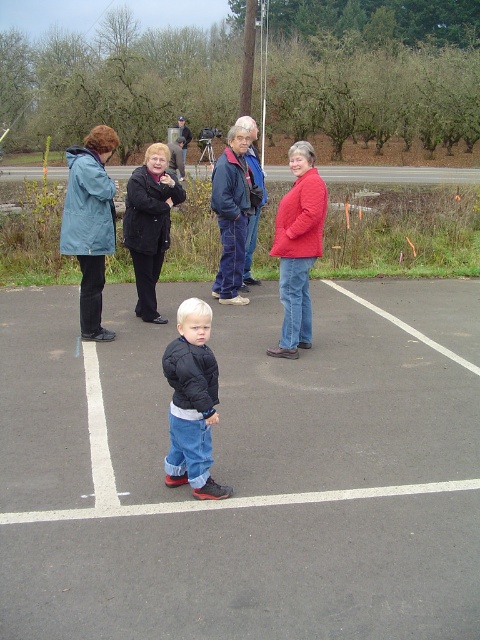
You are a photographer setting up your equipment in the parking lot. You have a blue waterproof jacket at left and a black plastic tripod at center. Which item is closer to the tripod when viewed from the photographer position?

The blue waterproof jacket at left is positioned on the right side of the black plastic tripod at center, so it is closer to the tripod than the photographer.

You are planning to place a small picnic blanket on the black asphalt parking lot at center and the black matte jacket at center. Which location would allow the blanket to fit entirely without overlapping any edges?

The black asphalt parking lot at center occupies less space than the black matte jacket at center, so the picnic blanket would fit entirely on the black matte jacket at center since it has more available space.